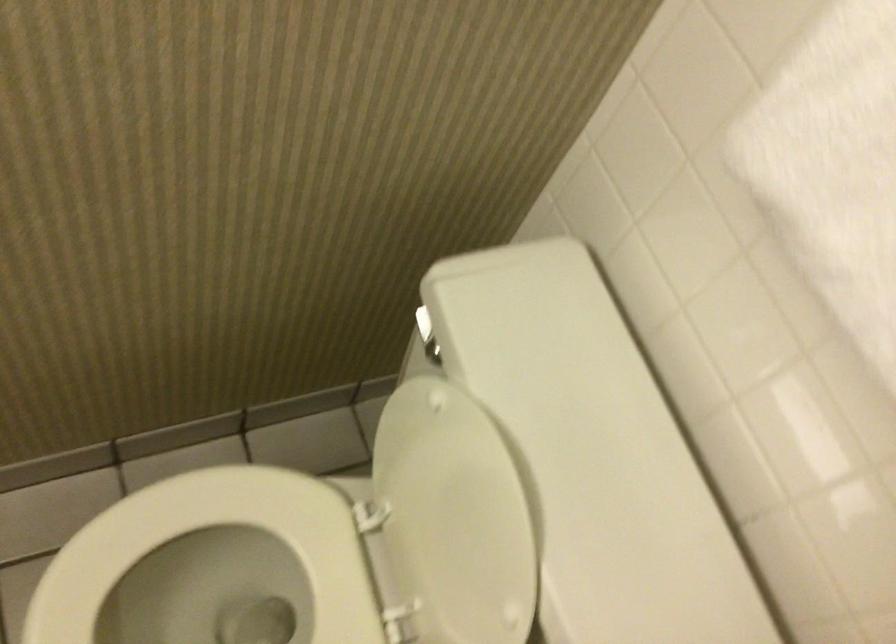
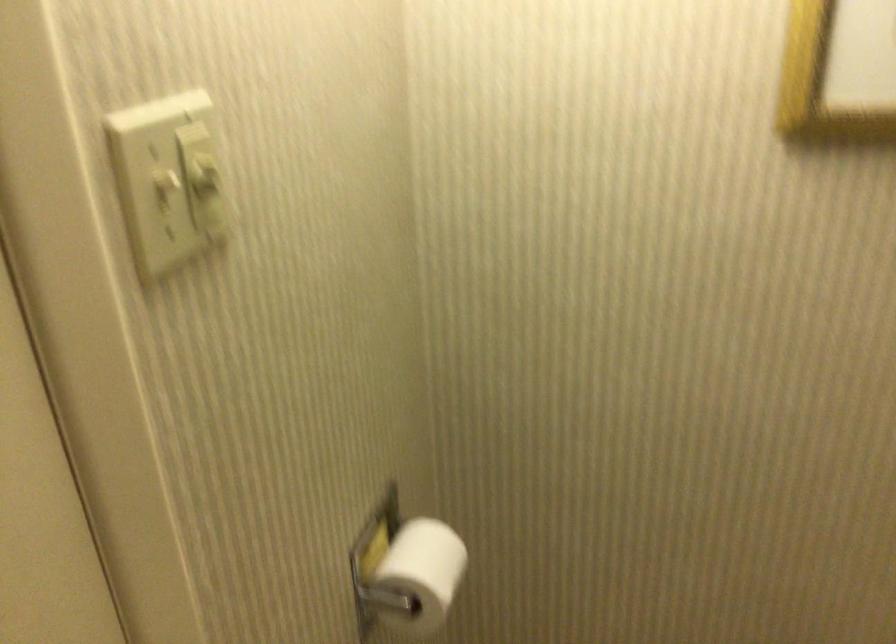
First-person continuous shooting, in which direction is the camera rotating?

The rotation direction of the camera is left-up.